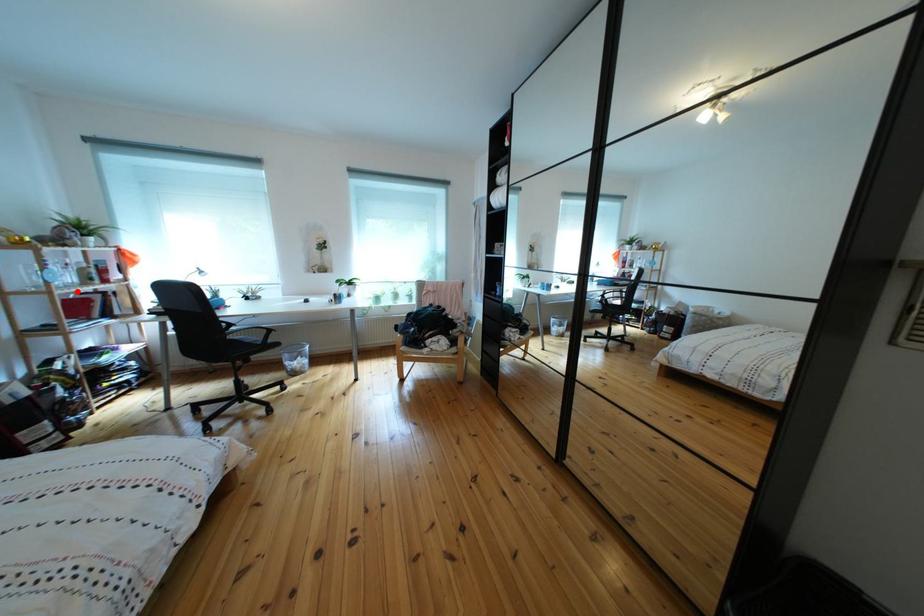
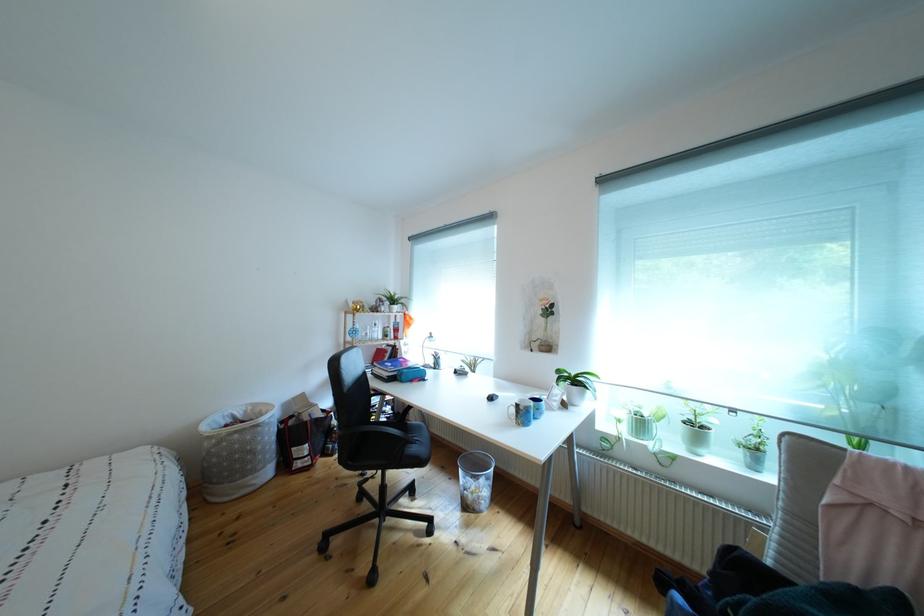
Where in the second image is the point corresponding to the highlighted location from the first image?

(383, 345)